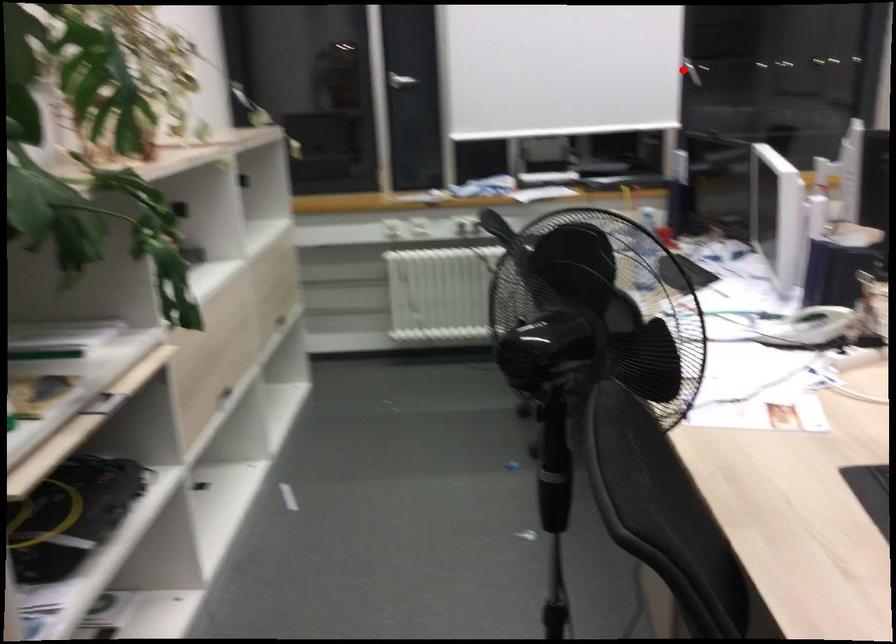
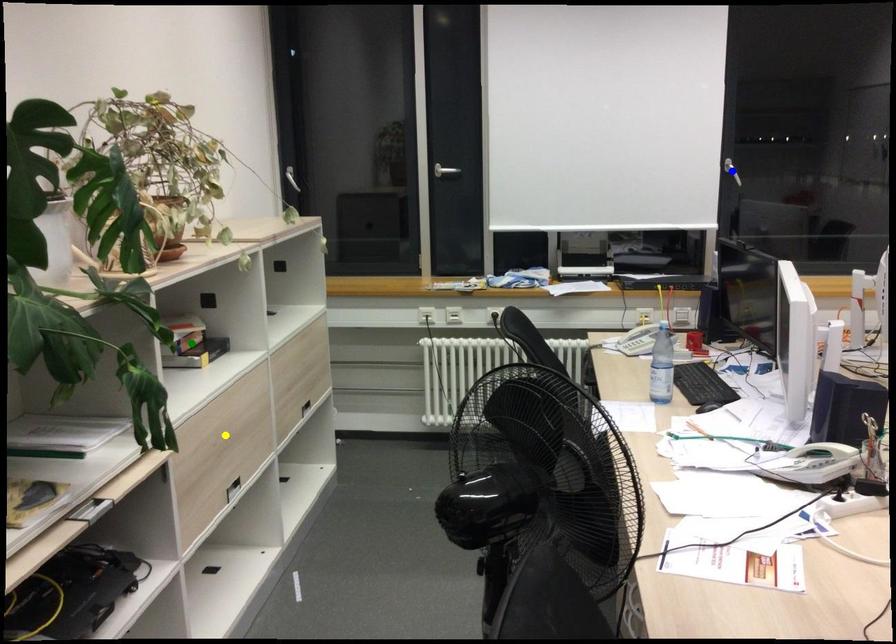
Question: I am providing you with two images of the same scene from different viewpoints. A red point is marked on the first image. You are given multiple points on the second image. Can you choose the point in image 2 that corresponds to the point in image 1?

Choices:
 (A) blue point
 (B) yellow point
 (C) green point

Answer: (A)